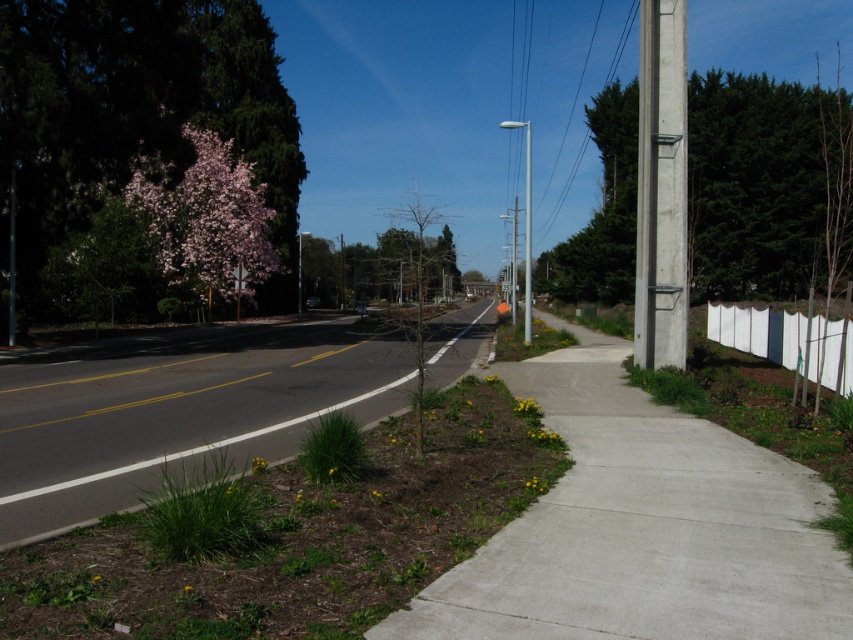
You are a delivery person trying to walk along the concrete sidewalk at center and the white fabric fence at right. Since you need to carry a large package, will you have enough space to walk comfortably between them?

The concrete sidewalk at center has a smaller size compared to white fabric fence at right, so there might not be enough space to walk comfortably with a large package between them.

Looking at this image, you are standing at the point labeled point (134, 106) on the pink blossoming tree at left. Which direction should you walk to reach the sidewalk on the right?

You should walk to the right because the sidewalk is on the right side of the road, so the point on the pink blossoming tree at left is on the opposite side of the sidewalk. Walking towards the right would lead you towards the sidewalk.